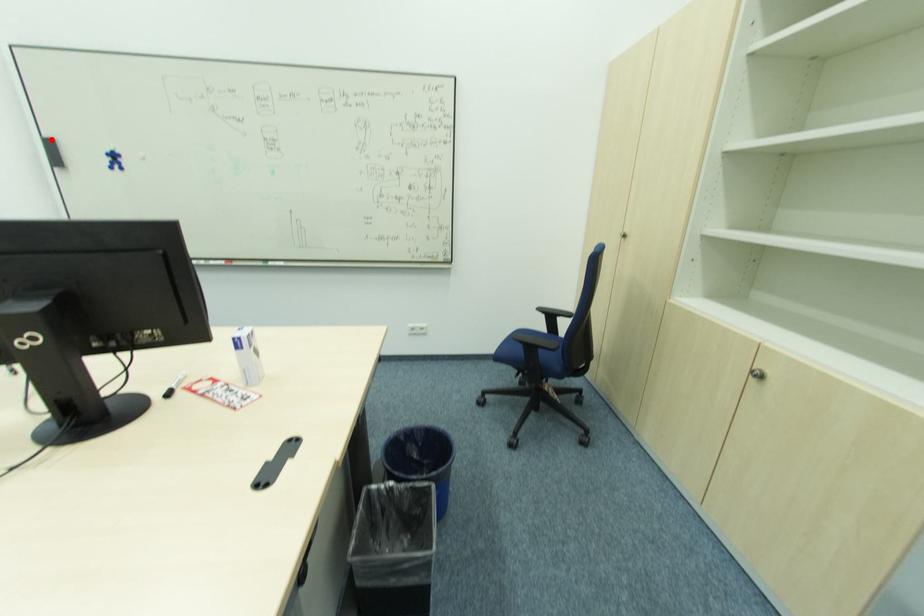
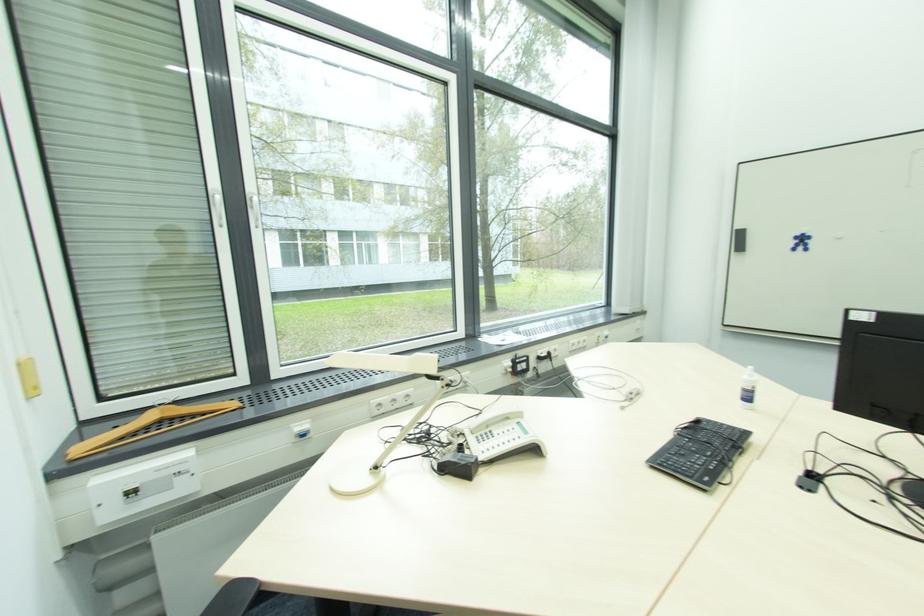
Question: I am providing you with two images of the same scene from different viewpoints. Image1 has a red point marked. In image2, the corresponding 3D location appears at what relative position? Reply with the corresponding letter.

Choices:
 (A) Closer
 (B) Farther

Answer: (A)